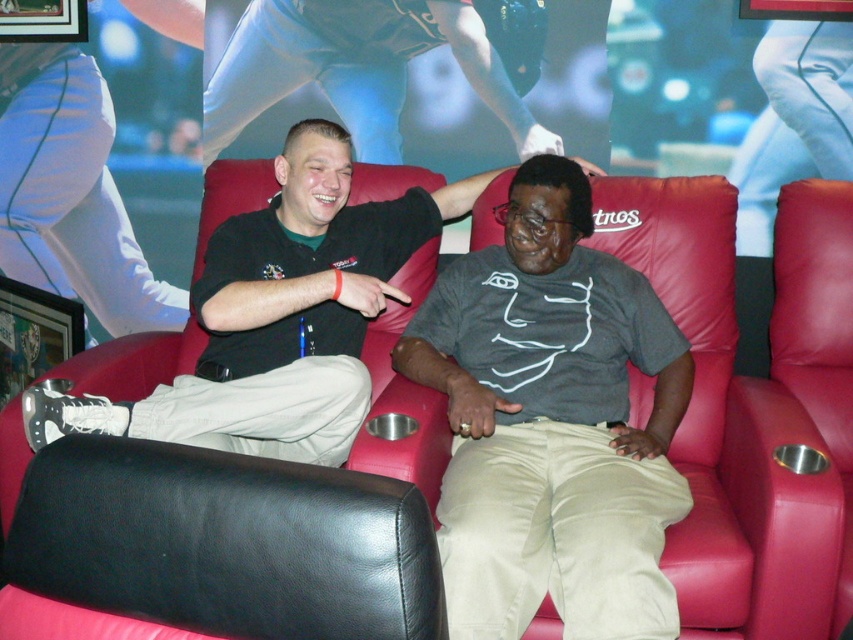
You are standing in front of the leather armchair at center and the matte black shirt at upper center. Which object is closer to you?

The leather armchair at center is closer to the viewer than the matte black shirt at upper center.

You are a photographer taking a picture of the khaki cotton pants at center and the matte black shirt at upper center. Which object is located to the right of the other?

The khaki cotton pants at center is positioned on the right side of matte black shirt at upper center.